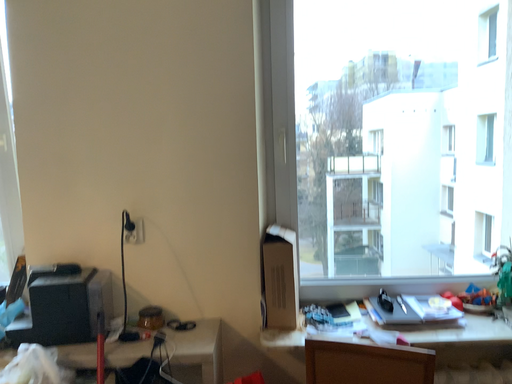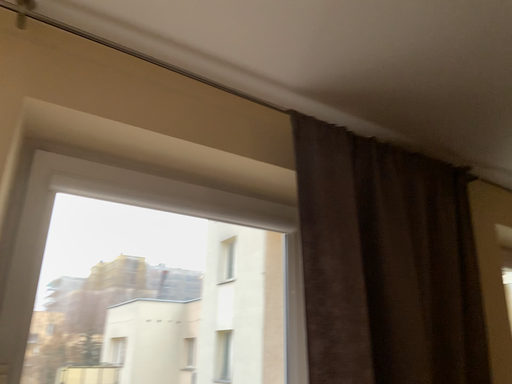
Question: Which way did the camera rotate in the video?

Choices:
 (A) rotated downward
 (B) rotated upward

Answer: (B)